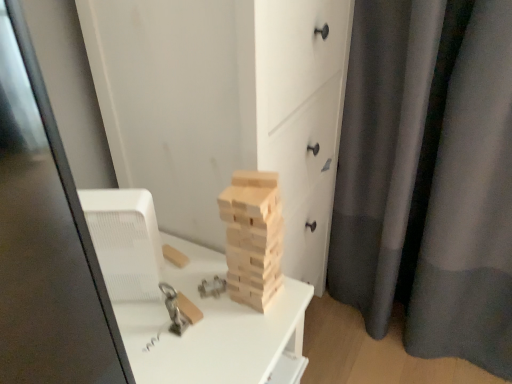
The image size is (512, 384). What do you see at coordinates (429, 177) in the screenshot? I see `gray matte curtain at right` at bounding box center [429, 177].

The image size is (512, 384). Describe the element at coordinates (253, 237) in the screenshot. I see `natural wood blocks at center` at that location.

You are a GUI agent. You are given a task and a screenshot of the screen. Output one action in this format:
    pyautogui.click(x=<x>, y=<y>)
    Task: Click on the wooden blocks at center
    This screenshot has height=384, width=512.
    Given the screenshot: What is the action you would take?
    pyautogui.click(x=224, y=107)

From a real-world perspective, relative to wooden blocks at center, is natural wood blocks at center vertically above or below?

In terms of real-world spatial position, natural wood blocks at center is above wooden blocks at center.

Can you see natural wood blocks at center touching wooden blocks at center?

No, natural wood blocks at center is not in contact with wooden blocks at center.

Who is taller, natural wood blocks at center or wooden blocks at center?

wooden blocks at center.

Are wooden blocks at center and gray matte curtain at right far apart?

No, there isn't a large distance between wooden blocks at center and gray matte curtain at right.

Can you confirm if wooden blocks at center is taller than gray matte curtain at right?

Yes.

In the image, is wooden blocks at center on the left side or the right side of gray matte curtain at right?

From the image, it's evident that wooden blocks at center is to the left of gray matte curtain at right.

From a real-world perspective, who is located higher, wooden blocks at center or gray matte curtain at right?

wooden blocks at center, from a real-world perspective.

Is gray matte curtain at right surrounding wooden blocks at center?

Definitely not — wooden blocks at center is not inside gray matte curtain at right.

From a real-world perspective, which object rests below the other?

gray matte curtain at right, from a real-world perspective.

Is gray matte curtain at right turned away from wooden blocks at center?

gray matte curtain at right does not have its back to wooden blocks at center.

Is gray matte curtain at right beside wooden blocks at center?

gray matte curtain at right is not next to wooden blocks at center, and they're not touching.

Find the location of a particular element. The width and height of the screenshot is (512, 384). drawer on the left of gray matte curtain at right is located at coordinates pos(253,237).

In the image, is gray matte curtain at right positioned in front of or behind natural wood blocks at center?

gray matte curtain at right is positioned farther from the viewer than natural wood blocks at center.

Is gray matte curtain at right positioned with its back to natural wood blocks at center?

gray matte curtain at right does not have its back to natural wood blocks at center.

Is wooden blocks at center facing away from natural wood blocks at center?

wooden blocks at center is not turned away from natural wood blocks at center.

Locate an element on the screen. The height and width of the screenshot is (384, 512). chest of drawers above the natural wood blocks at center (from the image's perspective) is located at coordinates (224, 107).

Does wooden blocks at center have a greater width compared to natural wood blocks at center?

Correct, the width of wooden blocks at center exceeds that of natural wood blocks at center.

Measure the distance from natural wood blocks at center to gray matte curtain at right.

A distance of 23.14 inches exists between natural wood blocks at center and gray matte curtain at right.

From a real-world perspective, which object stands above the other?

In real-world perspective, natural wood blocks at center is above.

Which object is positioned more to the left, natural wood blocks at center or gray matte curtain at right?

Positioned to the left is natural wood blocks at center.

From the image's perspective, which is below, natural wood blocks at center or gray matte curtain at right?

From the image's view, natural wood blocks at center is below.

Locate an element on the screen. chest of drawers above the natural wood blocks at center (from the image's perspective) is located at coordinates (224, 107).

Locate an element on the screen. the chest of drawers that appears above the gray matte curtain at right (from a real-world perspective) is located at coordinates (224, 107).

Considering their positions, is gray matte curtain at right positioned closer to natural wood blocks at center than wooden blocks at center?

wooden blocks at center is closer to natural wood blocks at center.

Which object lies further to the anchor point wooden blocks at center, natural wood blocks at center or gray matte curtain at right?

The object further to wooden blocks at center is gray matte curtain at right.

Considering their positions, is natural wood blocks at center positioned closer to gray matte curtain at right than wooden blocks at center?

Based on the image, wooden blocks at center appears to be nearer to gray matte curtain at right.

From the image, which object appears to be farther from natural wood blocks at center, wooden blocks at center or gray matte curtain at right?

gray matte curtain at right is further to natural wood blocks at center.

Based on their spatial positions, is gray matte curtain at right or natural wood blocks at center further from wooden blocks at center?

Among the two, gray matte curtain at right is located further to wooden blocks at center.

Looking at the image, which one is located closer to gray matte curtain at right, wooden blocks at center or natural wood blocks at center?

Among the two, wooden blocks at center is located nearer to gray matte curtain at right.

Where is `drawer situated between wooden blocks at center and gray matte curtain at right from left to right`? This screenshot has height=384, width=512. drawer situated between wooden blocks at center and gray matte curtain at right from left to right is located at coordinates (253, 237).